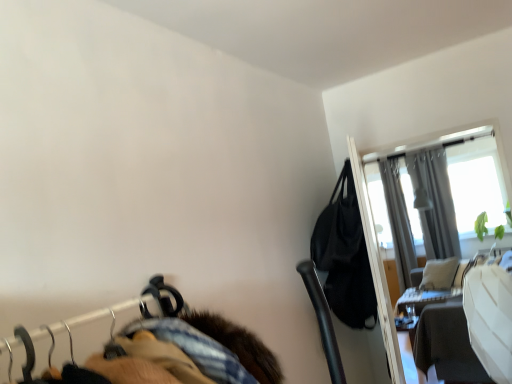
Question: Does point (324, 231) appear closer or farther from the camera than point (416, 302)?

Choices:
 (A) farther
 (B) closer

Answer: (B)

Question: Is black leather bag at upper right to the left or to the right of wooden table at right in the image?

Choices:
 (A) left
 (B) right

Answer: (A)

Question: Which object is positioned closest to the black leather bag at upper right?

Choices:
 (A) wooden table at right
 (B) transparent glass screen door at upper right
 (C) gray fabric curtain at upper right, the 2th curtain positioned from the left
 (D) gray fabric curtain at upper right, the 1th curtain positioned from the left

Answer: (B)

Question: Which is nearer to the gray fabric curtain at upper right, the 1th curtain positioned from the left?

Choices:
 (A) gray fabric curtain at upper right, the 2th curtain positioned from the left
 (B) black leather bag at upper right
 (C) wooden table at right
 (D) transparent glass screen door at upper right

Answer: (A)